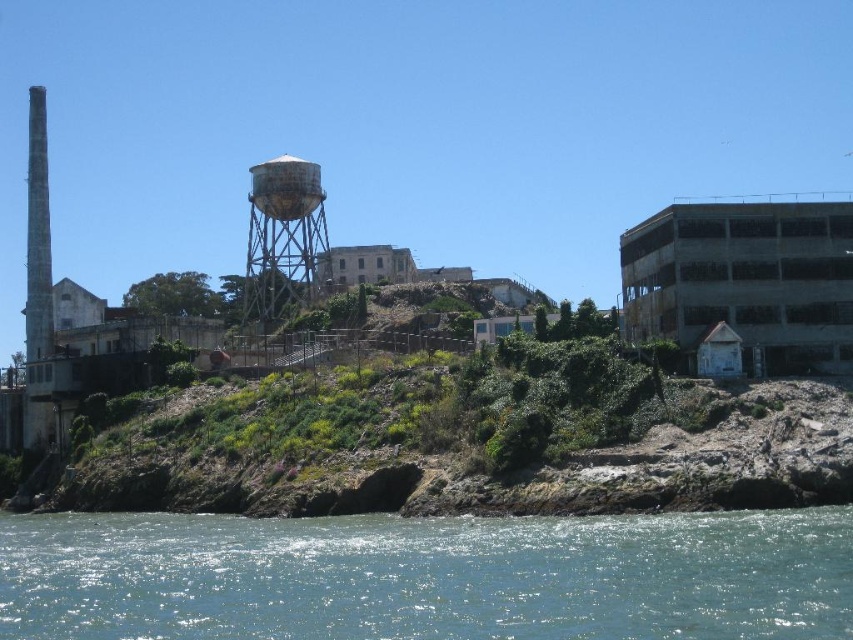
Which of these two, clear blue water at lower left or rusty metal water tower at center, stands shorter?

clear blue water at lower left is shorter.

Who is positioned more to the left, clear blue water at lower left or rusty metal water tower at center?

rusty metal water tower at center is more to the left.

Who is more distant from viewer, (648, 618) or (267, 221)?

The point (267, 221) is more distant.

At what (x,y) coordinates should I click in order to perform the action: click on clear blue water at lower left. Please return your answer as a coordinate pair (x, y). The width and height of the screenshot is (853, 640). Looking at the image, I should click on (427, 577).